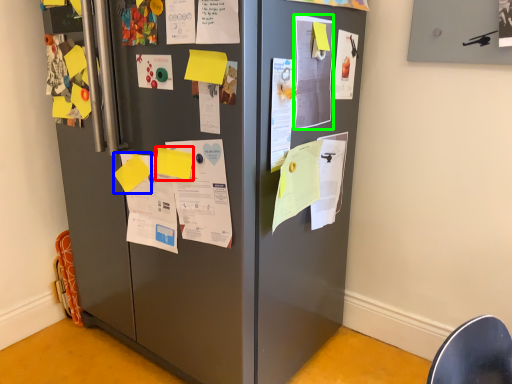
Question: Which object is positioned closest to paper (highlighted by a red box)? Select from paper (highlighted by a blue box) and poster (highlighted by a green box).

Choices:
 (A) paper
 (B) poster

Answer: (A)